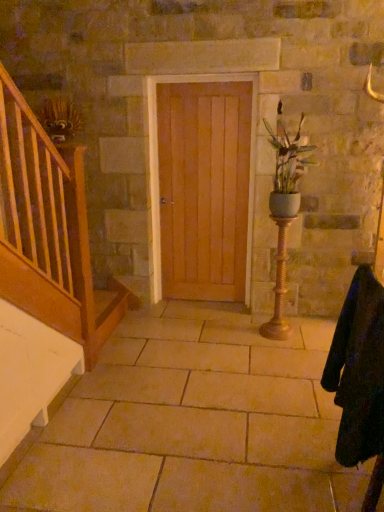
Question: In the image, is beige stone floor at center positioned in front of or behind light brown wood door at center?

Choices:
 (A) behind
 (B) front

Answer: (B)

Question: Considering the positions of beige stone floor at center and light brown wood door at center in the image, is beige stone floor at center wider or thinner than light brown wood door at center?

Choices:
 (A) thin
 (B) wide

Answer: (B)

Question: Which is nearer to the black woolen robe at lower right?

Choices:
 (A) gold textured candle holder at center right
 (B) beige stone floor at center
 (C) matte white vase at center right
 (D) light brown wood door at center

Answer: (B)

Question: Which object is the farthest from the gold textured candle holder at center right?

Choices:
 (A) matte white vase at center right
 (B) beige stone floor at center
 (C) light brown wood door at center
 (D) black woolen robe at lower right

Answer: (D)